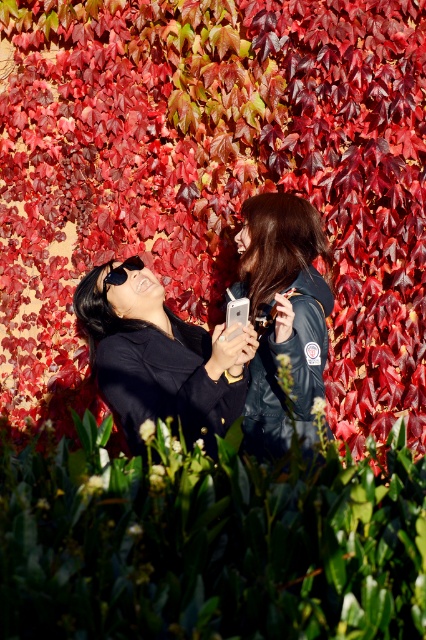
Who is taller, matte black jacket at center or black matte goggles at upper left?

With more height is matte black jacket at center.

What do you see at coordinates (207, 332) in the screenshot? The height and width of the screenshot is (640, 426). I see `matte black jacket at center` at bounding box center [207, 332].

At what (x,y) coordinates should I click in order to perform the action: click on matte black jacket at center. Please return your answer as a coordinate pair (x, y). This screenshot has height=640, width=426. Looking at the image, I should click on (207, 332).

Where is `dark green leather jacket at center`? This screenshot has width=426, height=640. dark green leather jacket at center is located at coordinates (282, 316).

Identify the location of dark green leather jacket at center. (282, 316).

Does shiny red leaves at upper center have a greater height compared to dark green leather jacket at center?

Indeed, shiny red leaves at upper center has a greater height compared to dark green leather jacket at center.

Can you confirm if shiny red leaves at upper center is thinner than dark green leather jacket at center?

No.

What do you see at coordinates (213, 177) in the screenshot? I see `shiny red leaves at upper center` at bounding box center [213, 177].

You are a GUI agent. You are given a task and a screenshot of the screen. Output one action in this format:
    pyautogui.click(x=<x>, y=<y>)
    Task: Click on the shiny red leaves at upper center
    
    Given the screenshot: What is the action you would take?
    pyautogui.click(x=213, y=177)